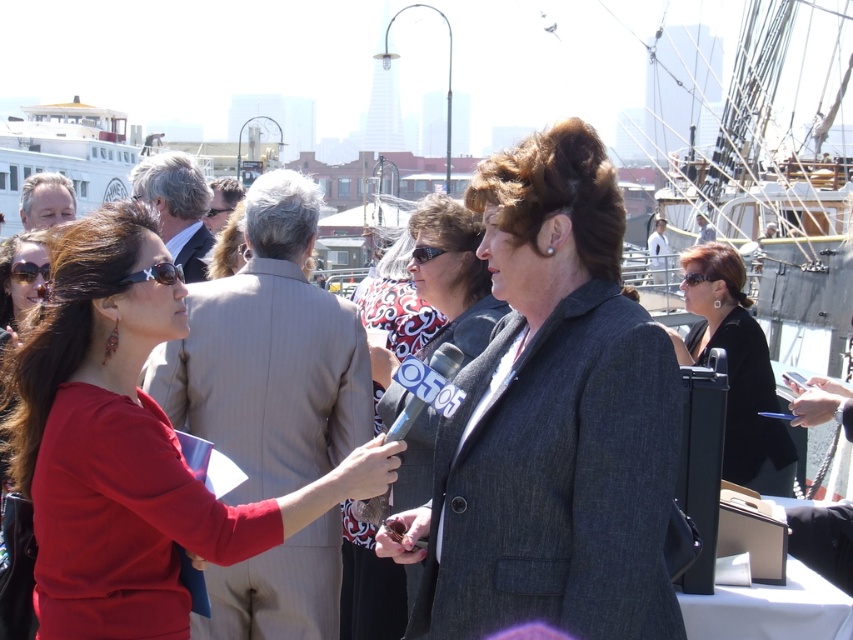
In the scene shown: Does gray wool blazer at center have a lesser width compared to light brown suit at upper left?

In fact, gray wool blazer at center might be wider than light brown suit at upper left.

Between point (640, 378) and point (165, 212), which one is positioned behind?

The point (165, 212) is behind.

This screenshot has width=853, height=640. I want to click on gray wool blazer at center, so click(x=552, y=420).

Does gray wool blazer at center lie behind white wooden ship at upper left?

No, gray wool blazer at center is closer to the viewer.

This screenshot has width=853, height=640. What do you see at coordinates (552, 420) in the screenshot?
I see `gray wool blazer at center` at bounding box center [552, 420].

In order to click on gray wool blazer at center in this screenshot , I will do `click(552, 420)`.

What do you see at coordinates (552, 420) in the screenshot? The width and height of the screenshot is (853, 640). I see `gray wool blazer at center` at bounding box center [552, 420].

Looking at this image, can you confirm if gray wool blazer at center is positioned to the right of dark brown hair at center?

Indeed, gray wool blazer at center is positioned on the right side of dark brown hair at center.

Image resolution: width=853 pixels, height=640 pixels. What do you see at coordinates (552, 420) in the screenshot?
I see `gray wool blazer at center` at bounding box center [552, 420].

You are a GUI agent. You are given a task and a screenshot of the screen. Output one action in this format:
    pyautogui.click(x=<x>, y=<y>)
    Task: Click on the gray wool blazer at center
    This screenshot has height=640, width=853.
    Given the screenshot: What is the action you would take?
    pyautogui.click(x=552, y=420)